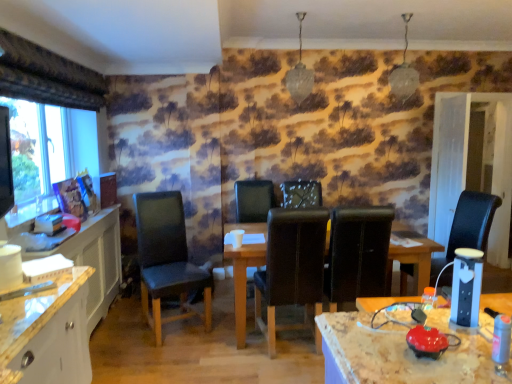
Question: Considering their positions, is matte black monitor at left located in front of or behind black leather chair at right, which is counted as the 1th chair, starting from the right?

Choices:
 (A) behind
 (B) front

Answer: (B)

Question: Which is correct: matte black monitor at left is inside black leather chair at right, the fifth chair when ordered from left to right, or outside of it?

Choices:
 (A) outside
 (B) inside

Answer: (A)

Question: Which object is the farthest from the leather at center?

Choices:
 (A) dark blue leather chair at center, which is counted as the 5th chair, starting from the right
 (B) black leather chair at right, which is counted as the 1th chair, starting from the right
 (C) leather at center, the fourth chair from the right
 (D) black leather chair at center, the third chair viewed from the left
 (E) leather-like black chair at center, which is counted as the 2th chair, starting from the right

Answer: (B)

Question: Which object is positioned closest to the black leather chair at center, which is the third chair in right-to-left order?

Choices:
 (A) white wood computer desk at left
 (B) matte black monitor at left
 (C) leather-like black chair at center, which is counted as the 4th chair, starting from the left
 (D) black leather chair at right, the fifth chair when ordered from left to right
 (E) dark blue leather chair at center, which ranks as the 1th chair in left-to-right order

Answer: (C)